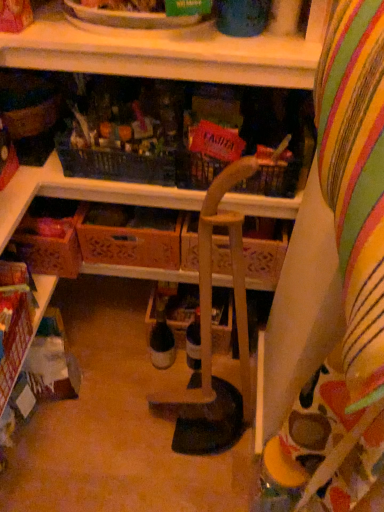
Where is `free space in front of wooden chair at center`? free space in front of wooden chair at center is located at coordinates (185, 477).